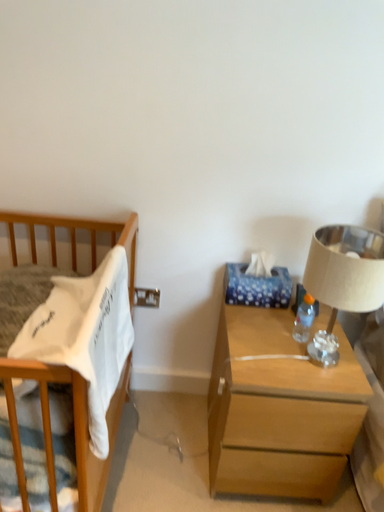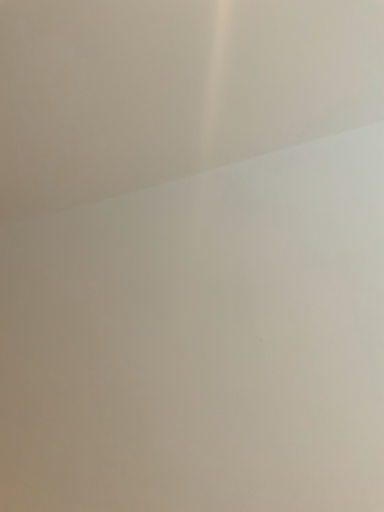
Question: Which way did the camera rotate in the video?

Choices:
 (A) rotated downward
 (B) rotated upward

Answer: (B)